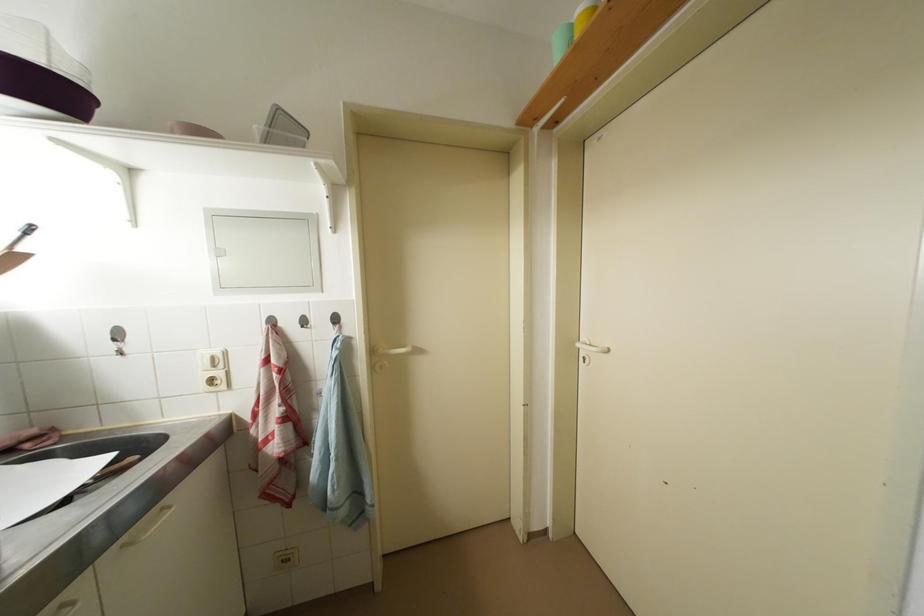
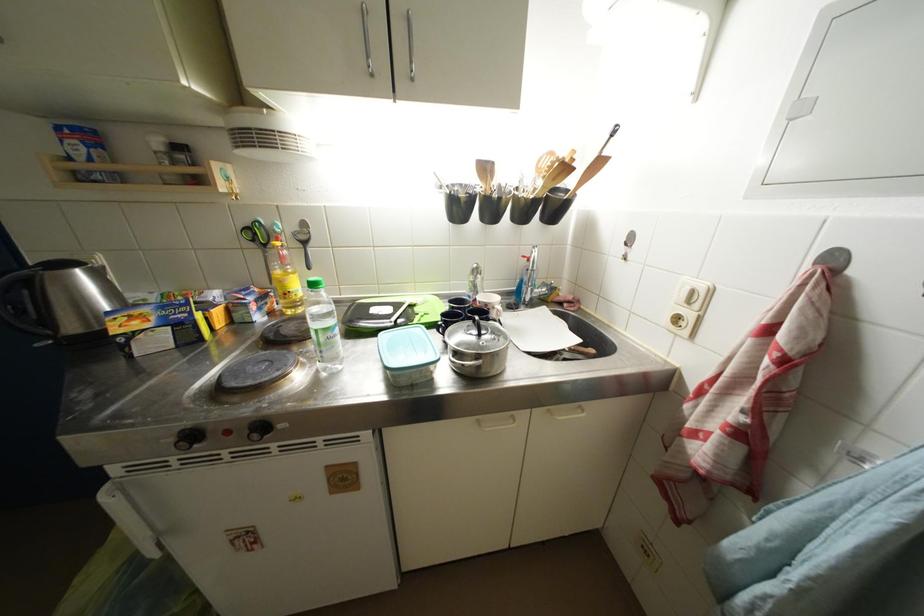
Where in the second image is the point corresponding to point (221, 370) from the first image?

(696, 306)